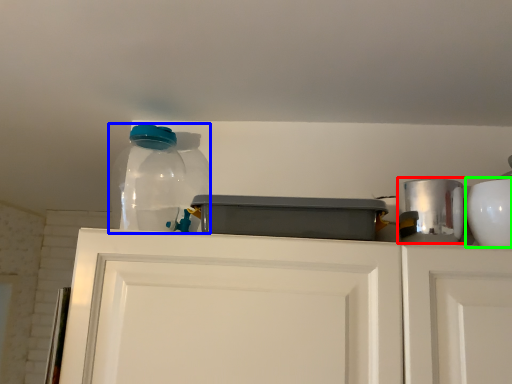
Question: Estimate the real-world distances between objects in this image. Which object is farther from appliance (highlighted by a red box), bottle (highlighted by a blue box) or appliance (highlighted by a green box)?

Choices:
 (A) bottle
 (B) appliance

Answer: (A)